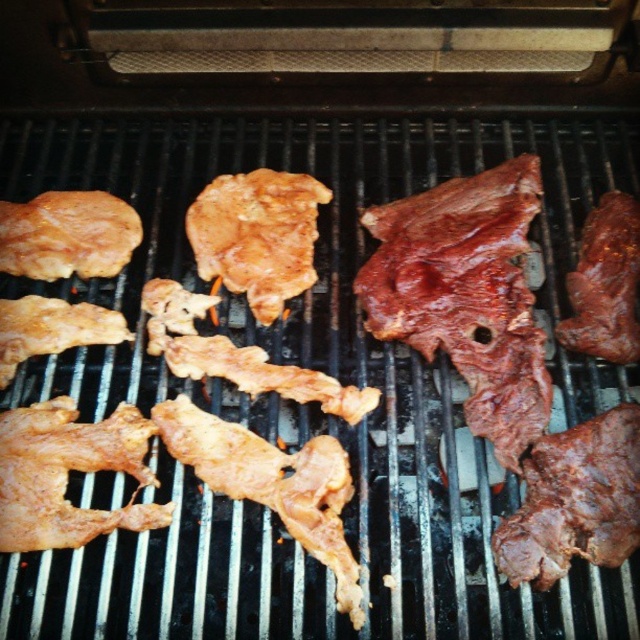
You are a chef preparing a barbecue and need to locate the dark brown charred steak at right. According to the coordinates provided, where exactly is it positioned on the grill?

The dark brown charred steak at right is positioned at point (467, 294) on the grill.

You are a chef using a coordinate system where the bottom left corner is the origin. The grill is divided into a grid with coordinates from 0 to 1 on both axes. Where is the brown matte chicken at center located on the grill?

The brown matte chicken at center is located at coordinates point [257,236].

You are a chef preparing a barbecue and need to arrange the golden brown crispy chicken wing at upper left and the shiny brown meat at right on a platter. Since the platter has limited space, which meat should be placed first to ensure both fit properly?

The golden brown crispy chicken wing at upper left is wider than the shiny brown meat at right, so place it first to accommodate its larger width before arranging the narrower shiny brown meat at right.